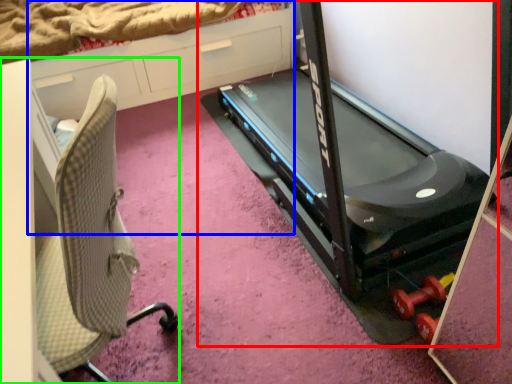
Question: Which object is the closest to the treadmill (highlighted by a red box)? Choose among these: dresser (highlighted by a blue box) or furniture (highlighted by a green box).

Choices:
 (A) dresser
 (B) furniture

Answer: (A)